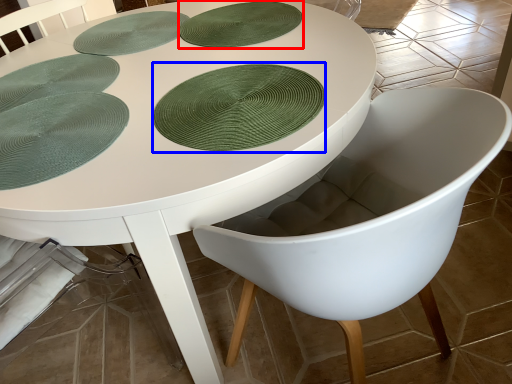
Question: Among these objects, which one is farthest to the camera, paper plate (highlighted by a red box) or paper plate (highlighted by a blue box)?

Choices:
 (A) paper plate
 (B) paper plate

Answer: (A)